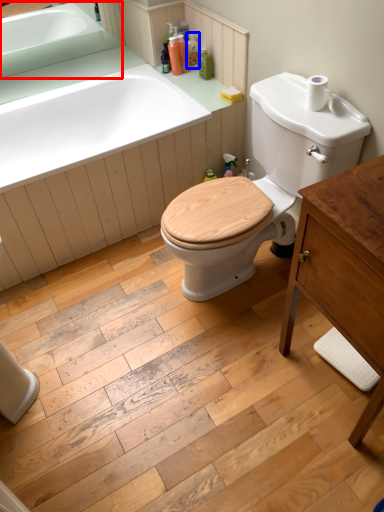
Question: Which object is closer to the camera taking this photo, sink (highlighted by a red box) or toiletry (highlighted by a blue box)?

Choices:
 (A) sink
 (B) toiletry

Answer: (A)